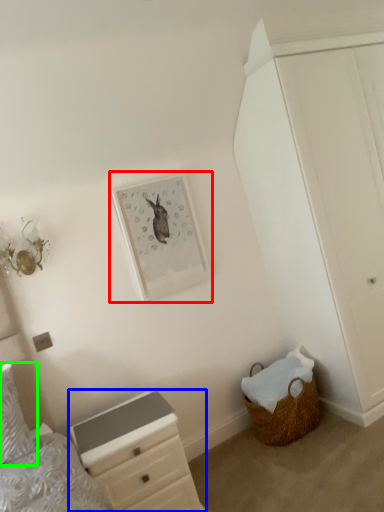
Question: Considering the real-world distances, which object is closest to picture frame (highlighted by a red box)? chest of drawers (highlighted by a blue box) or pillow (highlighted by a green box).

Choices:
 (A) chest of drawers
 (B) pillow

Answer: (A)